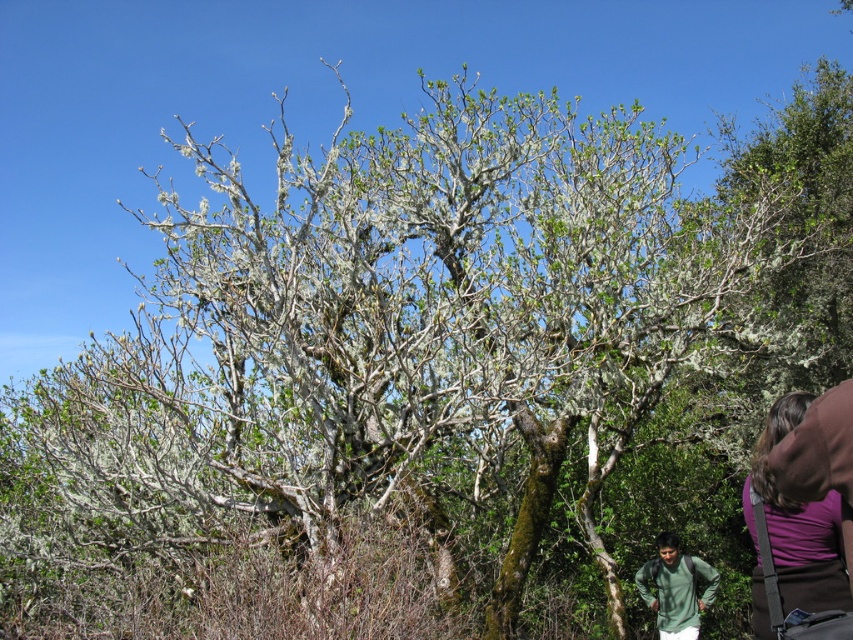
You are an artist setting up your easel to paint the large, gnarled tree. You notice two items at the lower right corner of your view. Which one of these, the purple fabric at lower right or the green matte shirt at lower right, would you need to move if you want to have a clear view of the tree trunk?

The purple fabric at lower right is bigger than the green matte shirt at lower right, so you would need to move the purple fabric at lower right to have a clear view of the tree trunk since it is larger and might obstruct more of the view.

You are an observer standing in front of the tree and notice the purple fabric at lower right and the green matte shirt at lower right. Which object is taller?

The purple fabric at lower right is taller than the green matte shirt at lower right according to the description.